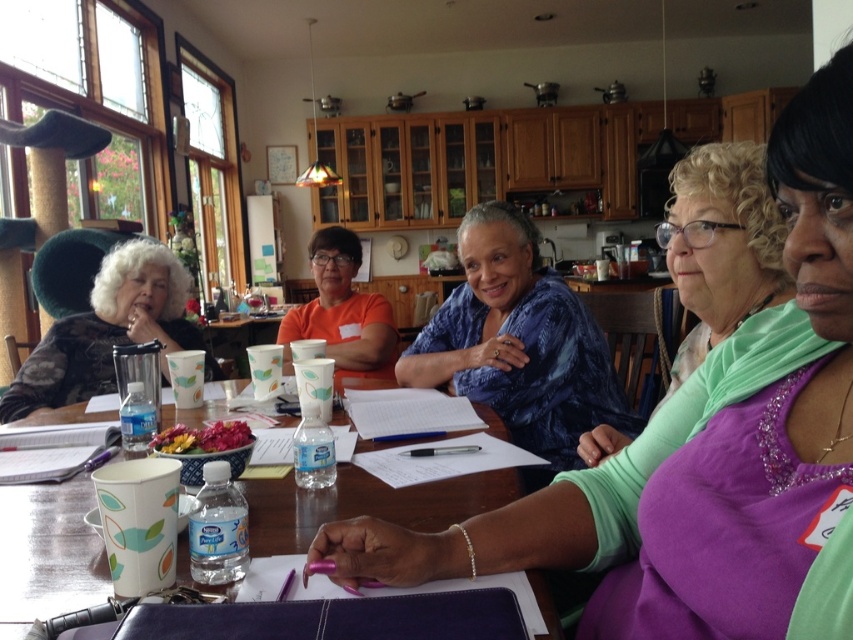
Question: Which point is farther from the camera taking this photo?

Choices:
 (A) (344, 352)
 (B) (576, 401)
 (C) (26, 385)

Answer: (A)

Question: Does green matte shirt at center come in front of orange fabric shirt at center?

Choices:
 (A) no
 (B) yes

Answer: (B)

Question: Which point is closer to the camera?

Choices:
 (A) green matte shirt at center
 (B) wooden table at center
 (C) blue patterned blouse at center

Answer: (B)

Question: Can you confirm if white fuzzy hat at upper left is bigger than orange fabric shirt at center?

Choices:
 (A) yes
 (B) no

Answer: (B)

Question: Which point is farther to the camera?

Choices:
 (A) green matte shirt at center
 (B) purple satin blouse at center
 (C) wooden table at center
 (D) blue patterned blouse at center

Answer: (D)

Question: Can you confirm if blue patterned blouse at center is wider than green matte shirt at center?

Choices:
 (A) no
 (B) yes

Answer: (B)